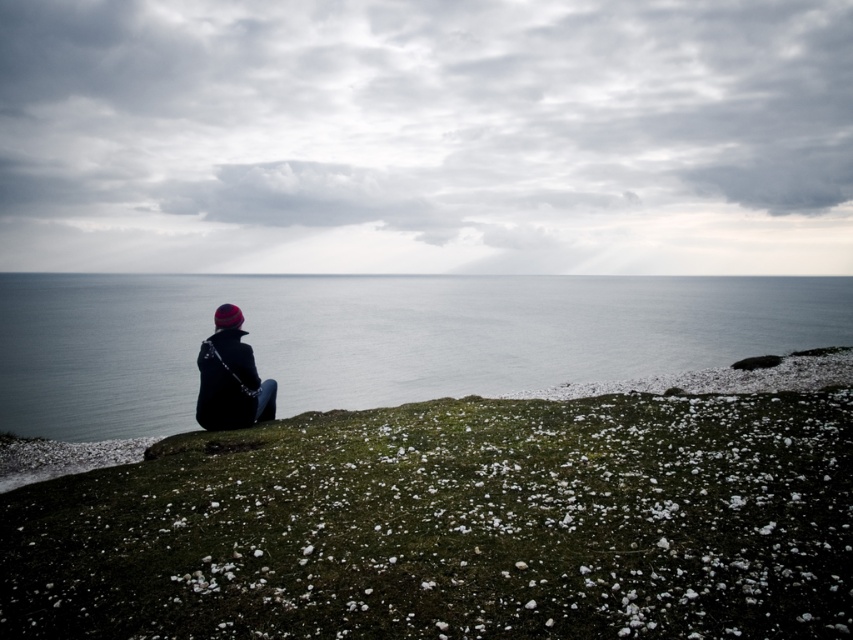
Does green mossy grass at center have a larger size compared to smooth blue water at center?

Incorrect, green mossy grass at center is not larger than smooth blue water at center.

Describe the element at coordinates (456, 525) in the screenshot. I see `green mossy grass at center` at that location.

Is point (488, 467) closer to viewer compared to point (706, 298)?

Yes.

This screenshot has width=853, height=640. I want to click on green mossy grass at center, so click(x=456, y=525).

Is green mossy grass at center smaller than dark blue fabric jacket at center?

Yes.

Which of these two, green mossy grass at center or dark blue fabric jacket at center, stands taller?

dark blue fabric jacket at center is taller.

Does point (157, 532) come farther from viewer compared to point (235, 404)?

No, it is in front of (235, 404).

Find the location of a particular element. The image size is (853, 640). green mossy grass at center is located at coordinates (456, 525).

Between smooth blue water at center and dark blue fabric jacket at center, which one has more height?

With more height is smooth blue water at center.

Is point (44, 312) less distant than point (235, 387)?

No.

Is point (172, 321) in front of point (215, 413)?

No, it is behind (215, 413).

Locate an element on the screen. The height and width of the screenshot is (640, 853). smooth blue water at center is located at coordinates (376, 339).